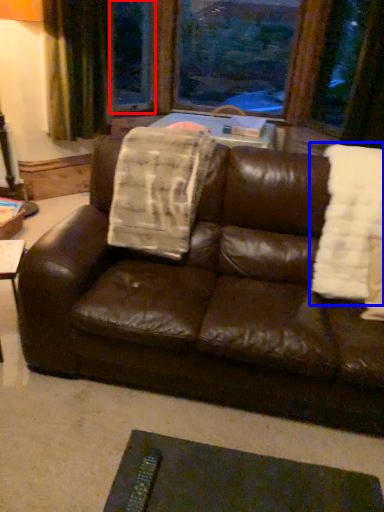
Question: Which point is closer to the camera, window screen (highlighted by a red box) or blanket (highlighted by a blue box)?

Choices:
 (A) window screen
 (B) blanket

Answer: (B)